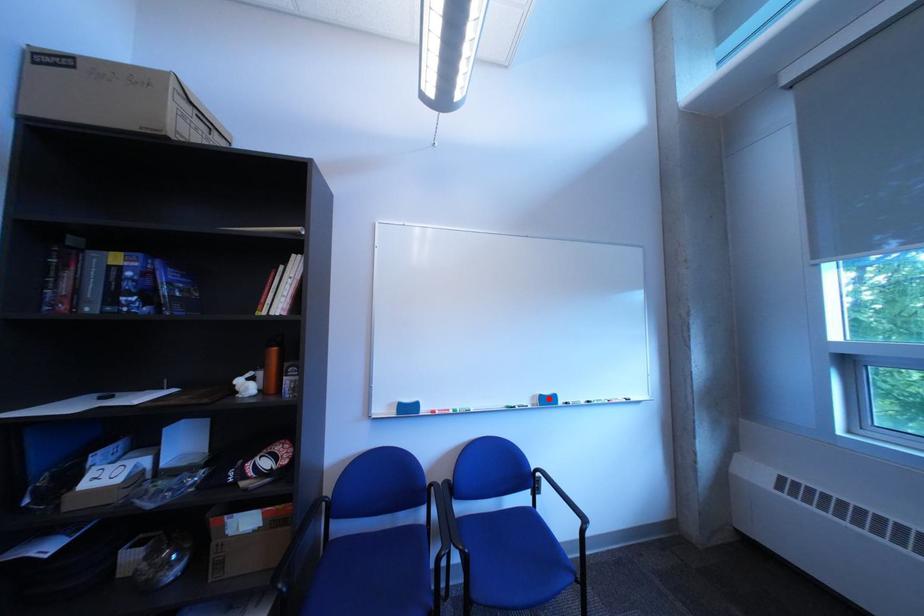
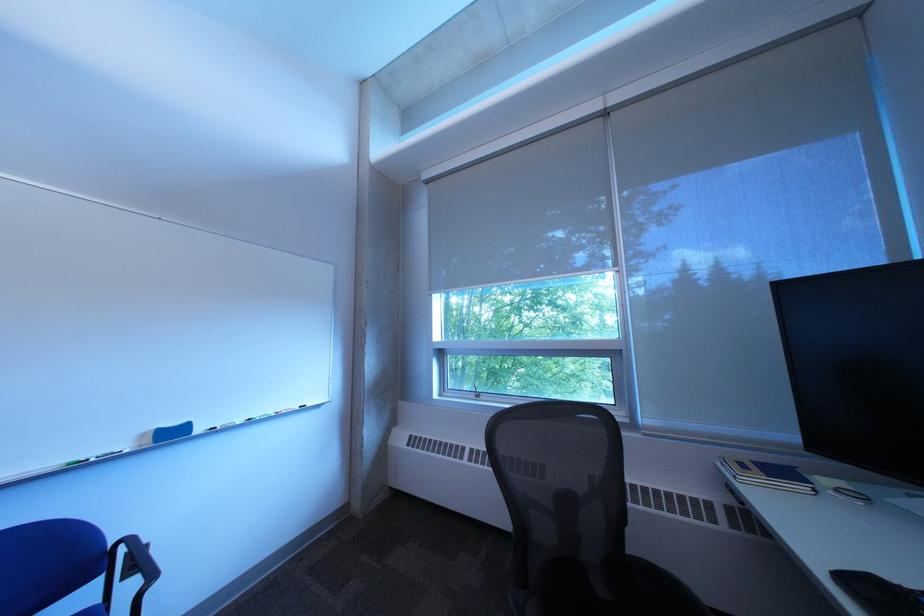
In the second image, find the point that corresponds to the highlighted location in the first image.

(159, 437)